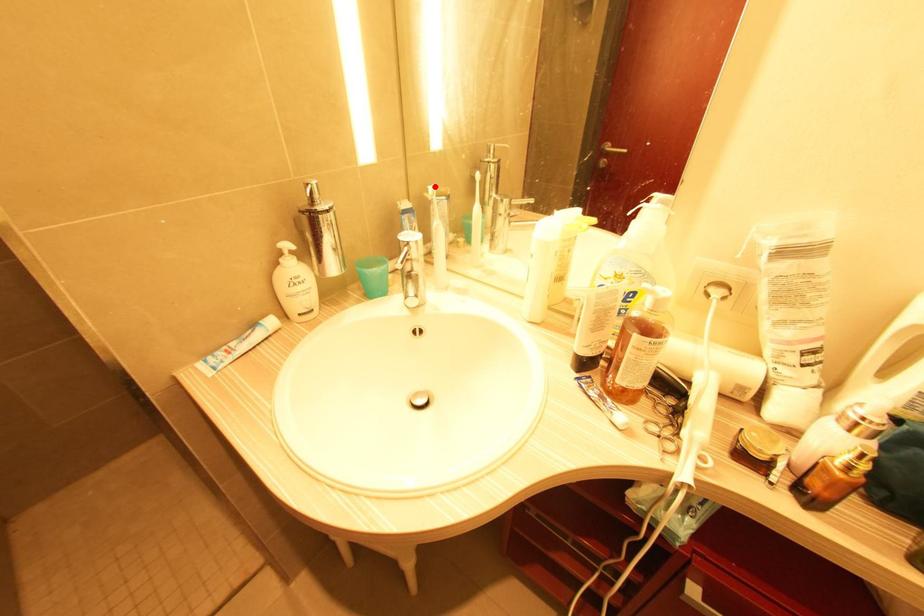
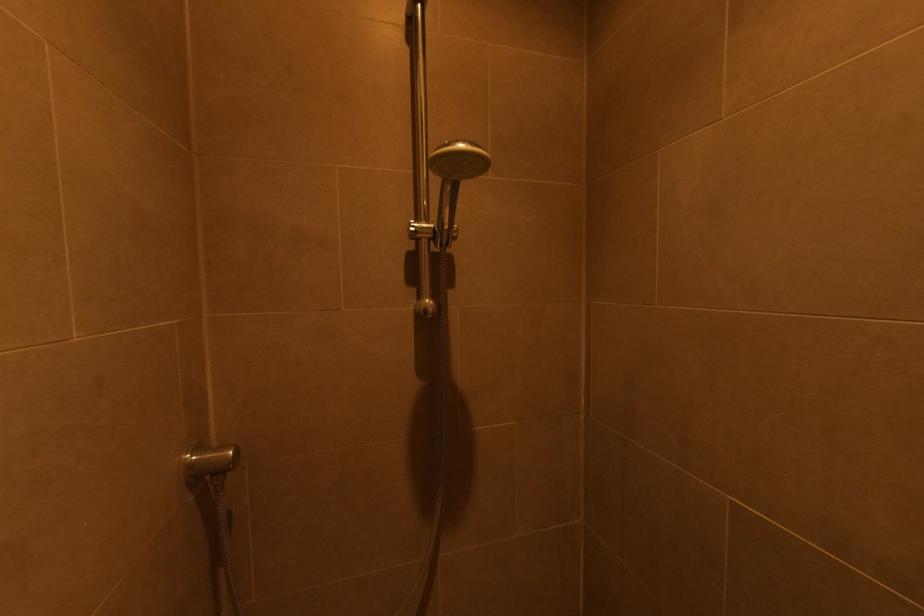
Question: I am providing you with two images of the same scene from different viewpoints. A red point is marked on the first image. Is the red point's position out of view in image 2?

Choices:
 (A) Yes
 (B) No

Answer: (A)